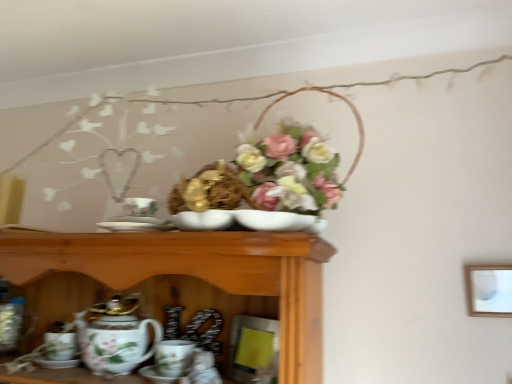
Question: Does point (160, 357) appear closer or farther from the camera than point (138, 205)?

Choices:
 (A) closer
 (B) farther

Answer: (B)

Question: Considering their positions, is porcelain coffee cup at lower center located in front of or behind porcelain plate at center?

Choices:
 (A) behind
 (B) front

Answer: (A)

Question: Which object is the farthest from the porcelain floral teapot at lower left?

Choices:
 (A) porcelain coffee cup at lower center
 (B) porcelain plate at center
 (C) matte white picture frame at upper right

Answer: (C)

Question: Estimate the real-world distances between objects in this image. Which object is closer to the porcelain coffee cup at lower center?

Choices:
 (A) porcelain floral teapot at lower left
 (B) porcelain plate at center
 (C) matte white picture frame at upper right

Answer: (A)